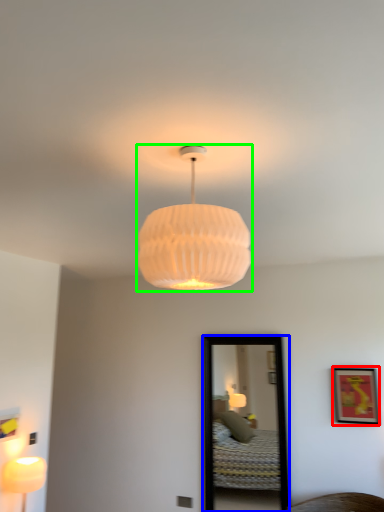
Question: Which object is positioned farthest from picture frame (highlighted by a red box)? Select from mirror (highlighted by a blue box) and lamp (highlighted by a green box).

Choices:
 (A) mirror
 (B) lamp

Answer: (B)